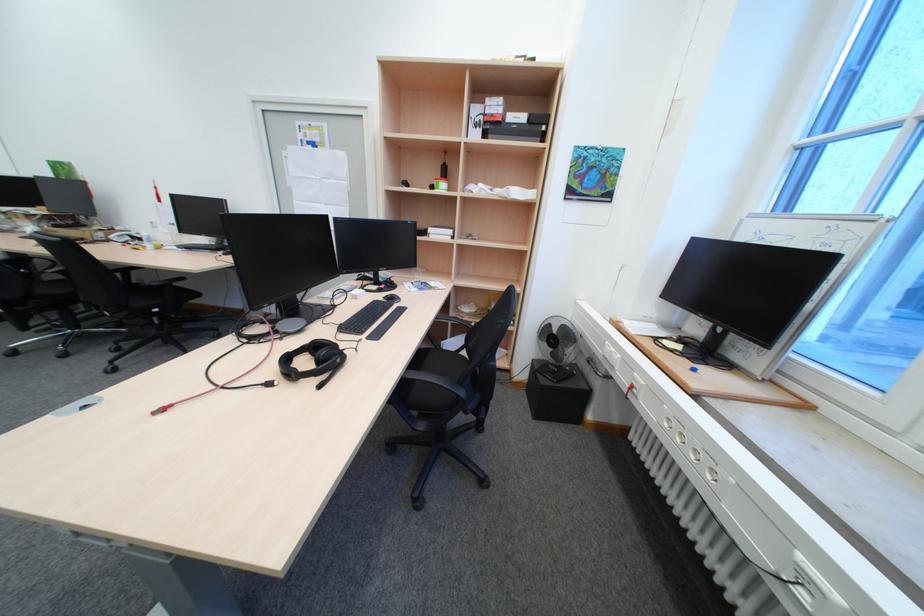
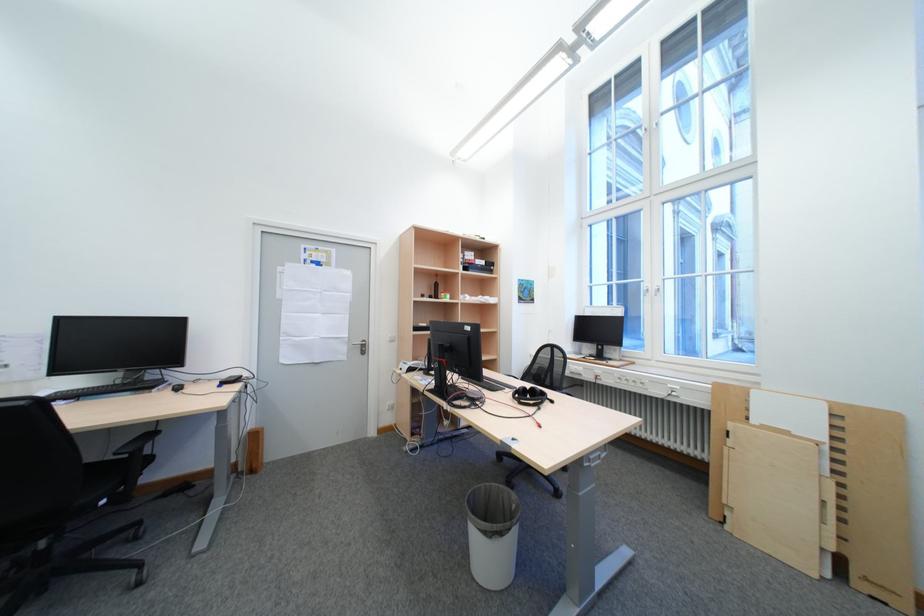
Find the pixel in the second image that matches the point at 167,310 in the first image.

(116, 503)